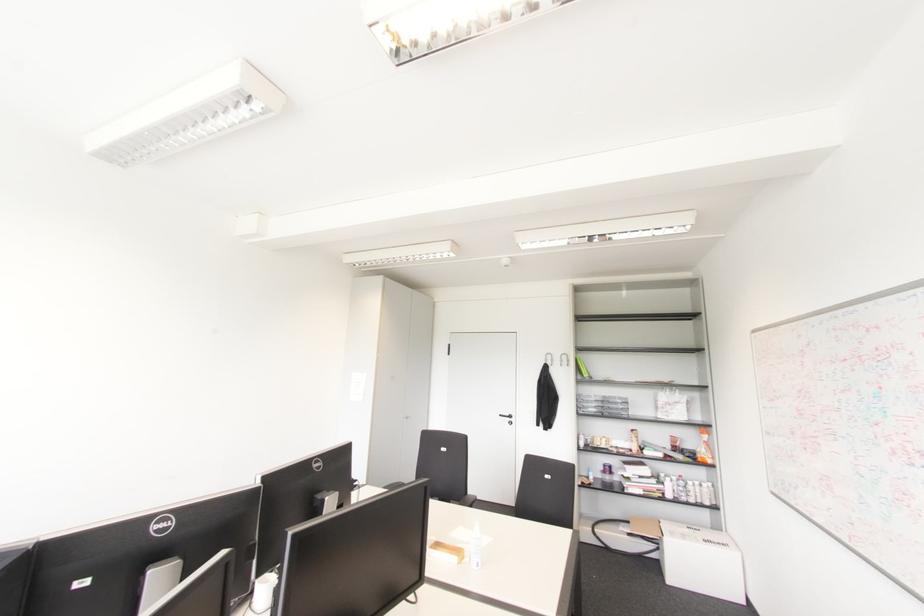
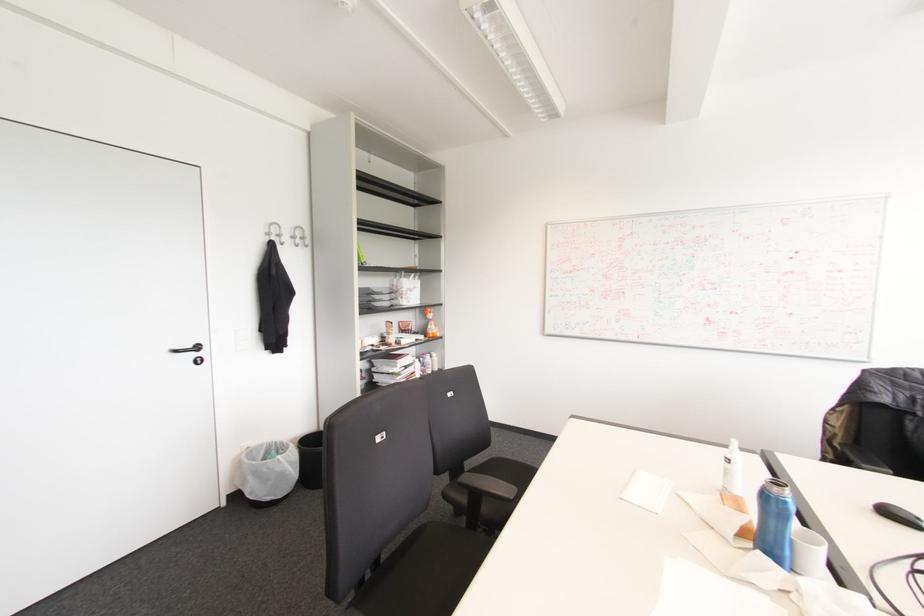
Question: I am providing you with two images of the same scene from different viewpoints. After the viewpoint changes to image2, which objects are now occluded?

Choices:
 (A) soda can
 (B) black chair armrest
 (C) white coffee mug
 (D) none of these

Answer: (D)